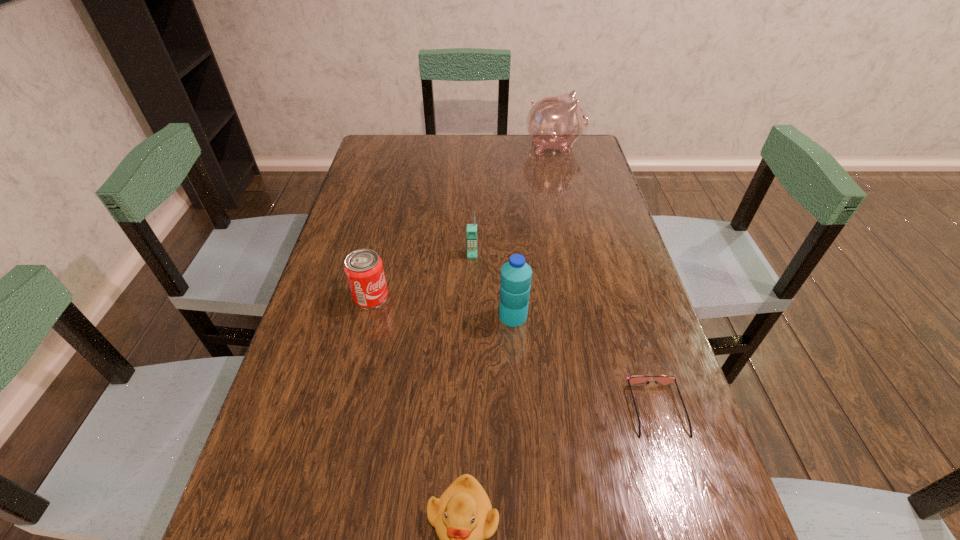
I want to click on unoccupied area between the cellular telephone and the fifth farthest object, so click(564, 332).

Where is `vacant point located between the can and the cellular telephone`? This screenshot has height=540, width=960. vacant point located between the can and the cellular telephone is located at coordinates (421, 275).

The height and width of the screenshot is (540, 960). What are the coordinates of `free area in between the fourth object from left to right and the leftmost object` in the screenshot? It's located at (442, 306).

You are a GUI agent. You are given a task and a screenshot of the screen. Output one action in this format:
    pyautogui.click(x=<x>, y=<y>)
    Task: Click on the free spot between the water bottle and the leftmost object
    The height and width of the screenshot is (540, 960).
    Given the screenshot: What is the action you would take?
    pyautogui.click(x=442, y=306)

This screenshot has height=540, width=960. I want to click on free spot between the farthest object and the shortest object, so click(x=606, y=278).

The image size is (960, 540). In order to click on empty space that is in between the water bottle and the cellular telephone in this screenshot , I will do `click(492, 285)`.

Where is `object that stands as the third closest to the fifth farthest object`? The height and width of the screenshot is (540, 960). object that stands as the third closest to the fifth farthest object is located at coordinates (471, 231).

This screenshot has height=540, width=960. What are the coordinates of `the closest object relative to the piggy bank` in the screenshot? It's located at (471, 231).

This screenshot has width=960, height=540. I want to click on free space that satisfies the following two spatial constraints: 1. on the keypad of the fifth nearest object; 2. on the left side of the fourth object from left to right, so click(x=471, y=316).

This screenshot has height=540, width=960. Identify the location of vacant space that satisfies the following two spatial constraints: 1. on the keypad of the cellular telephone; 2. on the left side of the water bottle. (471, 316).